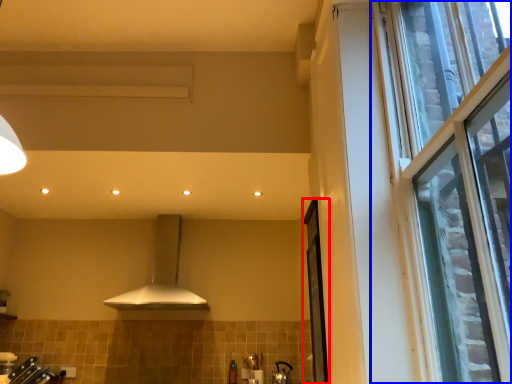
Question: Among these objects, which one is farthest to the camera, screen door (highlighted by a red box) or window (highlighted by a blue box)?

Choices:
 (A) screen door
 (B) window

Answer: (A)